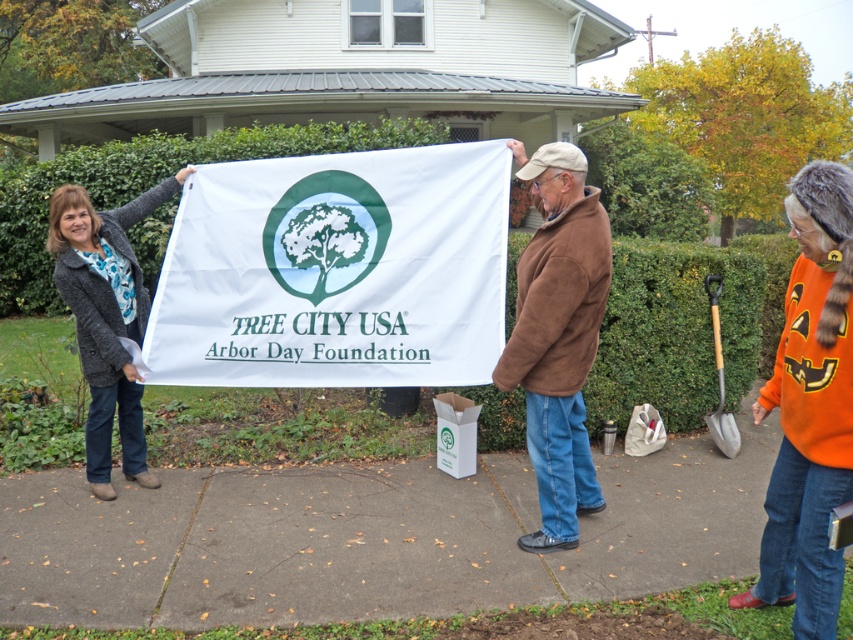
Question: Which point is farther from the camera taking this photo?

Choices:
 (A) (372, 269)
 (B) (148, 198)

Answer: (B)

Question: Does brown fleece jacket at center have a greater width compared to dark gray textured jacket at left?

Choices:
 (A) yes
 (B) no

Answer: (B)

Question: In this image, where is brown fleece jacket at center located relative to dark gray textured jacket at left?

Choices:
 (A) right
 (B) left

Answer: (A)

Question: Is white fabric banner at center to the right of dark gray textured jacket at left from the viewer's perspective?

Choices:
 (A) yes
 (B) no

Answer: (A)

Question: Which is farther from the brown fleece jacket at center?

Choices:
 (A) white fabric banner at center
 (B) dark gray textured jacket at left

Answer: (B)

Question: Which of these objects is positioned closest to the brown fleece jacket at center?

Choices:
 (A) white fabric banner at center
 (B) dark gray textured jacket at left

Answer: (A)